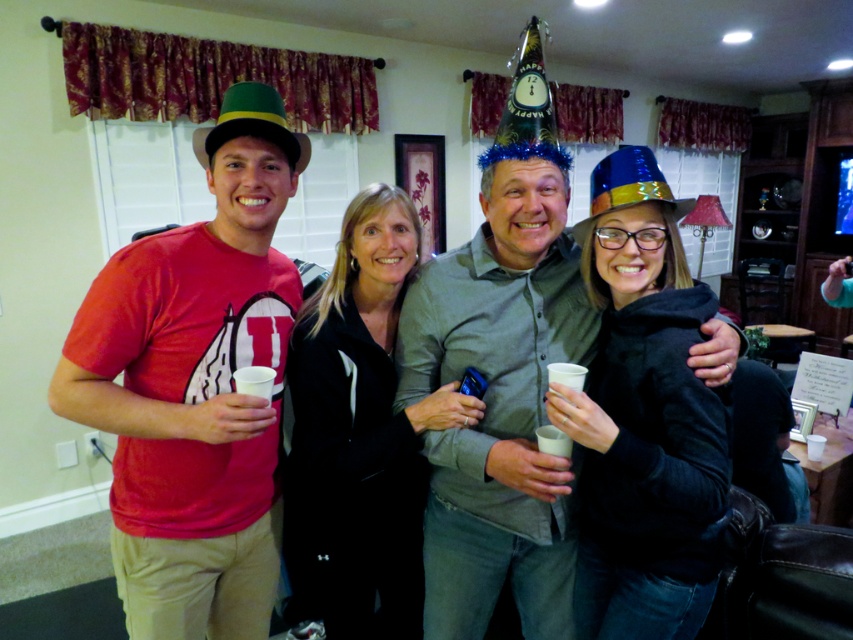
You are a photographer trying to capture the perfect shot of the matte gray shirt at center and the shiny metallic party hat at center. Based on their positions, which object should you focus on first to ensure both are in frame?

The matte gray shirt at center is located below the shiny metallic party hat at center, so you should focus on the shiny metallic party hat at center first to ensure both are in frame.

You are planning to place a 12 inch long decorative ribbon between the matte gray shirt at center and the shiny metallic party hat at center. Will the ribbon fit perfectly between them without needing to be adjusted?

Result: The distance between the matte gray shirt at center and the shiny metallic party hat at center is 16.31 inches. Since the ribbon is only 12 inches long, it will not reach the full distance and will need to be adjusted to fit.